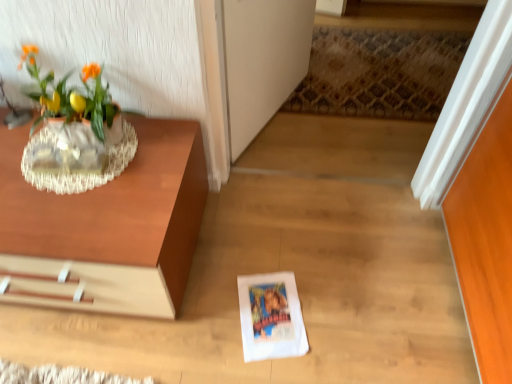
Locate an element on the screen. The image size is (512, 384). vacant area that is in front of clear glass vase at upper left is located at coordinates point(70,223).